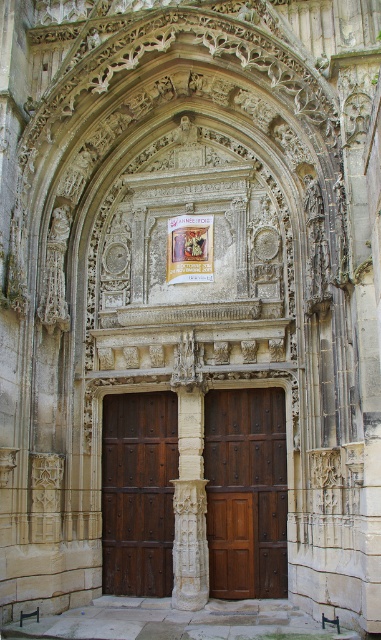
You are standing in front of the Gothic building entrance and need to enter. Where exactly is the polished wood door at center located?

The polished wood door at center is located at point (246, 492).

You are standing at the entrance of a Gothic building and notice a point marked at coordinates (137,492). What object is located at this point?

The point at coordinates (137,492) indicates the dark brown wood door at center.

You are a visitor approaching the entrance of the Gothic building. You see two doors, the polished wood door at center and the dark brown wood door at center. Which door is positioned higher relative to the other?

The polished wood door at center is located above the dark brown wood door at center, so it is positioned higher.